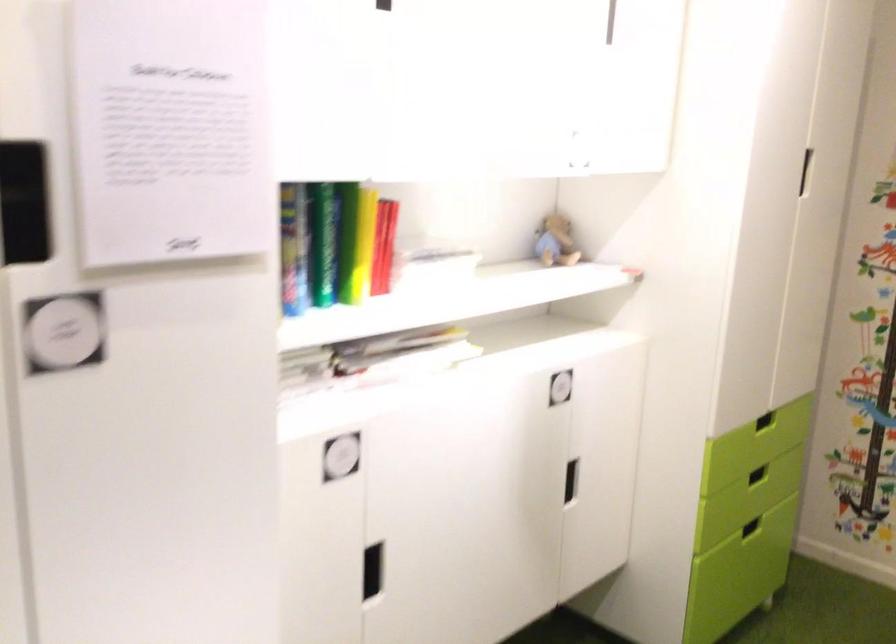
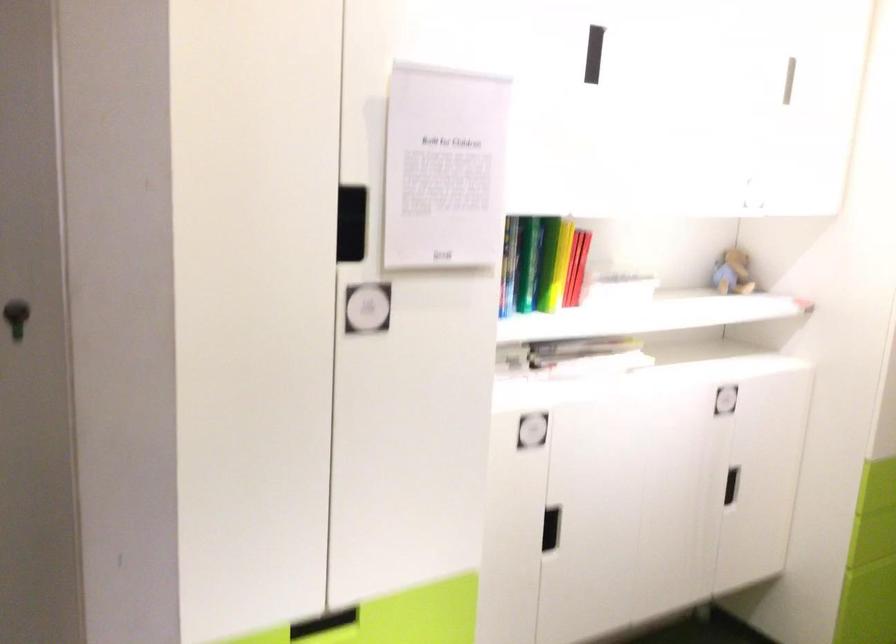
The point at (556, 241) is marked in the first image. Where is the corresponding point in the second image?

(733, 272)